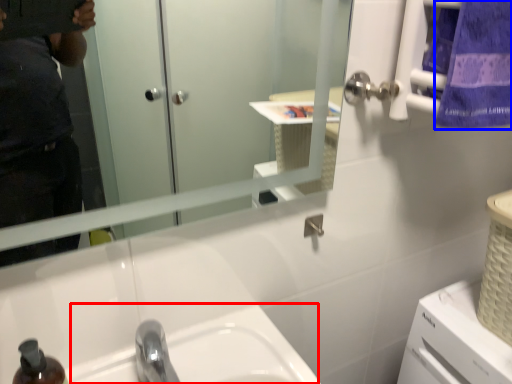
Question: Which of the following is the closest to the observer, sink (highlighted by a red box) or towel/napkin (highlighted by a blue box)?

Choices:
 (A) sink
 (B) towel/napkin

Answer: (A)